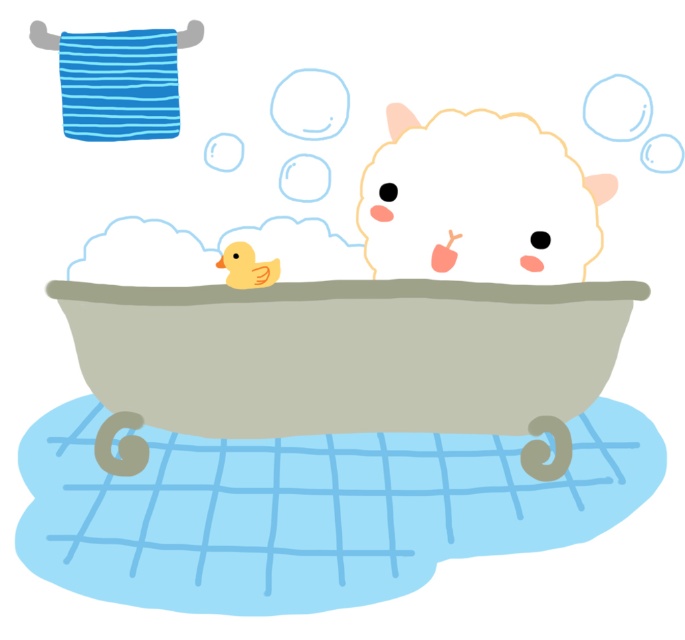
Is matte gray bathtub at center bigger than fluffy white animal at upper center?

Indeed, matte gray bathtub at center has a larger size compared to fluffy white animal at upper center.

Which is behind, point (386, 408) or point (399, 163)?

Positioned behind is point (399, 163).

Does point (499, 394) come in front of point (464, 205)?

Yes, point (499, 394) is closer to viewer.

The height and width of the screenshot is (640, 685). I want to click on matte gray bathtub at center, so click(347, 353).

Between point (375, 260) and point (227, 268), which one is positioned behind?

Positioned behind is point (375, 260).

From the picture: Who is higher up, fluffy white animal at upper center or yellow rubber duck at center?

fluffy white animal at upper center is higher up.

Who is more distant from viewer, (493,273) or (234,253)?

Point (493,273)

What are the coordinates of `fluffy white animal at upper center` in the screenshot? It's located at (477, 204).

Based on the photo, who is taller, matte gray bathtub at center or yellow rubber duck at center?

With more height is matte gray bathtub at center.

Between matte gray bathtub at center and yellow rubber duck at center, which one is positioned higher?

Positioned higher is yellow rubber duck at center.

Between point (451, 428) and point (236, 268), which one is positioned behind?

Positioned behind is point (451, 428).

The image size is (685, 640). Find the location of `matte gray bathtub at center`. matte gray bathtub at center is located at coordinates (347, 353).